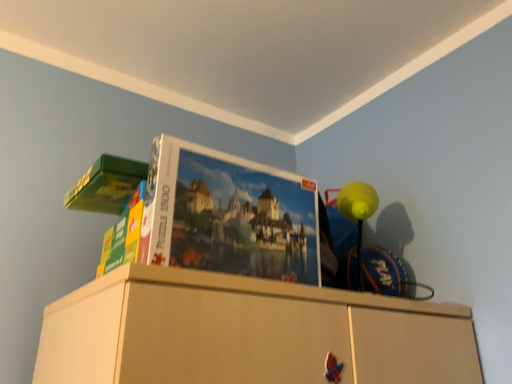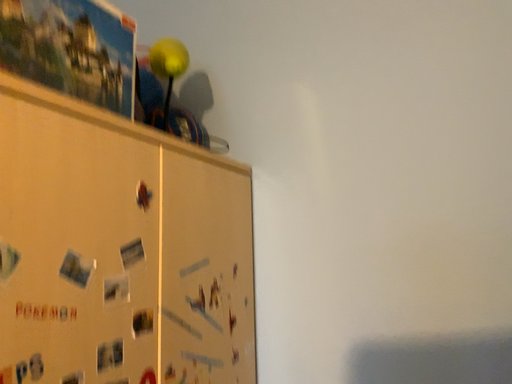
Question: How did the camera likely rotate when shooting the video?

Choices:
 (A) rotated downward
 (B) rotated upward

Answer: (A)